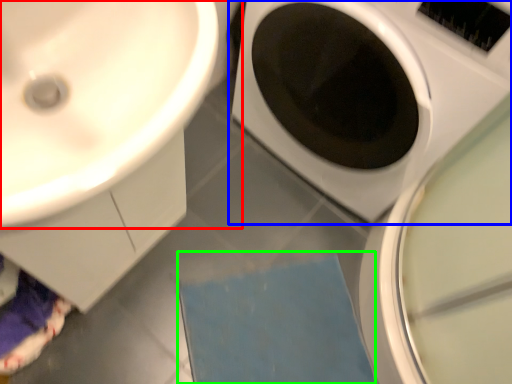
Question: Which is nearer to the sink (highlighted by a red box)? washing machine (highlighted by a blue box) or bath mat (highlighted by a green box).

Choices:
 (A) washing machine
 (B) bath mat

Answer: (A)